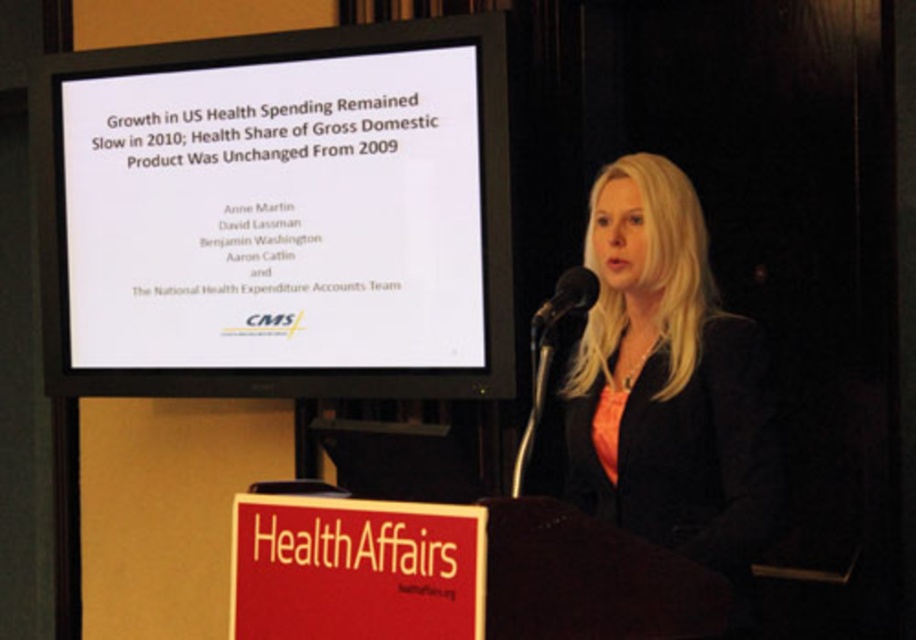
Does blonde hair at center appear on the left side of black matte microphone at center?

In fact, blonde hair at center is to the right of black matte microphone at center.

Between point (704, 428) and point (554, 321), which one is positioned behind?

Positioned behind is point (554, 321).

Locate an element on the screen. blonde hair at center is located at coordinates (664, 387).

Can you confirm if white glossy projector screen at upper center is positioned to the right of black matte microphone at center?

No, white glossy projector screen at upper center is not to the right of black matte microphone at center.

Between white glossy projector screen at upper center and black matte microphone at center, which one is positioned higher?

white glossy projector screen at upper center is higher up.

Does point (424, 323) come in front of point (551, 316)?

No, it is behind (551, 316).

You are a GUI agent. You are given a task and a screenshot of the screen. Output one action in this format:
    pyautogui.click(x=<x>, y=<y>)
    Task: Click on the white glossy projector screen at upper center
    This screenshot has height=640, width=916.
    Given the screenshot: What is the action you would take?
    pyautogui.click(x=279, y=214)

Is point (124, 182) in front of point (754, 449)?

That is False.

Does white glossy projector screen at upper center appear over blonde hair at center?

Indeed, white glossy projector screen at upper center is positioned over blonde hair at center.

Where is `white glossy projector screen at upper center`? Image resolution: width=916 pixels, height=640 pixels. white glossy projector screen at upper center is located at coordinates (279, 214).

This screenshot has height=640, width=916. What are the coordinates of `white glossy projector screen at upper center` in the screenshot? It's located at (279, 214).